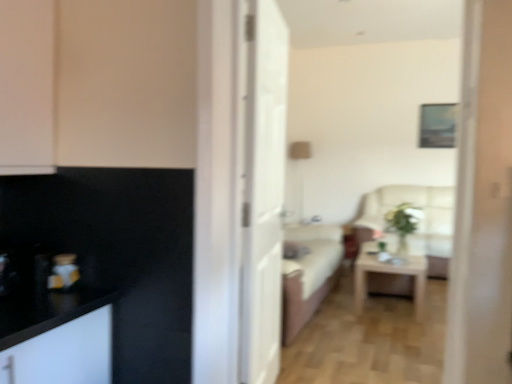
Question: Is white glossy door at center to the right of black matte cabinet at upper left from the viewer's perspective?

Choices:
 (A) yes
 (B) no

Answer: (A)

Question: Does white glossy door at center have a larger size compared to black matte cabinet at upper left?

Choices:
 (A) yes
 (B) no

Answer: (A)

Question: From a real-world perspective, is white glossy door at center physically above black matte cabinet at upper left?

Choices:
 (A) yes
 (B) no

Answer: (B)

Question: Is white glossy door at center not within black matte cabinet at upper left?

Choices:
 (A) yes
 (B) no

Answer: (A)

Question: Is white glossy door at center closer to camera compared to black matte cabinet at upper left?

Choices:
 (A) no
 (B) yes

Answer: (A)

Question: From a real-world perspective, is white glossy door at center below black matte cabinet at upper left?

Choices:
 (A) no
 (B) yes

Answer: (B)

Question: From the image's perspective, is black matte cabinet at upper left located above light wood/wooden table at center?

Choices:
 (A) no
 (B) yes

Answer: (B)

Question: Can you confirm if black matte cabinet at upper left is smaller than light wood/wooden table at center?

Choices:
 (A) no
 (B) yes

Answer: (B)

Question: Is black matte cabinet at upper left positioned with its back to light wood/wooden table at center?

Choices:
 (A) no
 (B) yes

Answer: (A)

Question: Is black matte cabinet at upper left not within light wood/wooden table at center?

Choices:
 (A) no
 (B) yes

Answer: (B)

Question: Does black matte cabinet at upper left have a lesser width compared to light wood/wooden table at center?

Choices:
 (A) no
 (B) yes

Answer: (B)

Question: Is black matte cabinet at upper left aimed at light wood/wooden table at center?

Choices:
 (A) no
 (B) yes

Answer: (A)

Question: Does metallic gold vase at left have a greater height compared to beige fabric armchair at center?

Choices:
 (A) yes
 (B) no

Answer: (B)